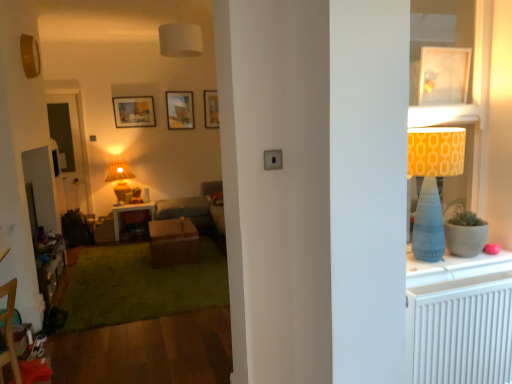
This screenshot has height=384, width=512. Find the location of `matte wooden desk at center`. matte wooden desk at center is located at coordinates (130, 210).

Where is `textured gray couch at center`? textured gray couch at center is located at coordinates (194, 208).

Describe the element at coordinates (74, 152) in the screenshot. I see `transparent glass door at left` at that location.

Locate an element on the screen. Image resolution: width=512 pixels, height=384 pixels. matte wooden desk at center is located at coordinates (130, 210).

Is matte yellow lampshade at center, the 1th lamp from the back, next to white glossy picture frame at upper right, which appears as the 4th picture frame when viewed from the back?

matte yellow lampshade at center, the 1th lamp from the back, and white glossy picture frame at upper right, which appears as the 4th picture frame when viewed from the back, are not in contact.

Is point (132, 173) closer or farther from the camera than point (455, 48)?

Point (132, 173) is positioned farther from the camera compared to point (455, 48).

Between matte yellow lampshade at center, the 1th lamp from the back, and white glossy picture frame at upper right, the 4th picture frame from the left, which one has larger size?

With larger size is matte yellow lampshade at center, the 1th lamp from the back.

Does matte yellow lampshade at center, which appears as the 1th lamp when viewed from the left, lie behind white glossy picture frame at upper right, which appears as the 4th picture frame when viewed from the back?

Yes, matte yellow lampshade at center, which appears as the 1th lamp when viewed from the left, is behind white glossy picture frame at upper right, which appears as the 4th picture frame when viewed from the back.

Find the location of a particular element. lamp that is the 3rd one when counting forward from the wooden picture frame at upper center, the 1th picture frame when ordered from back to front is located at coordinates (432, 183).

Is wooden picture frame at upper center, marked as the 4th picture frame in a front-to-back arrangement, completely or partially outside of matte blue cone-shaped lampshade at right, which is the third lamp from left to right?

wooden picture frame at upper center, marked as the 4th picture frame in a front-to-back arrangement, is positioned outside matte blue cone-shaped lampshade at right, which is the third lamp from left to right.

Does wooden picture frame at upper center, marked as the 4th picture frame in a front-to-back arrangement, have a larger size compared to matte blue cone-shaped lampshade at right, positioned as the first lamp in front-to-back order?

No.

How much distance is there between wooden picture frame at upper center, marked as the 4th picture frame in a front-to-back arrangement, and matte blue cone-shaped lampshade at right, which is the first lamp in right-to-left order?

wooden picture frame at upper center, marked as the 4th picture frame in a front-to-back arrangement, and matte blue cone-shaped lampshade at right, which is the first lamp in right-to-left order, are 5.18 meters apart from each other.

Does point (46, 251) come behind point (453, 147)?

Yes, point (46, 251) is farther from viewer.

Does wooden dresser at lower left come behind matte blue cone-shaped lampshade at right, the first lamp in the bottom-to-top sequence?

Yes, it is.

From a real-world perspective, which is physically above, wooden dresser at lower left or matte blue cone-shaped lampshade at right, the first lamp in the bottom-to-top sequence?

matte blue cone-shaped lampshade at right, the first lamp in the bottom-to-top sequence, from a real-world perspective.

Which is correct: wooden dresser at lower left is inside matte blue cone-shaped lampshade at right, which is the first lamp in right-to-left order, or outside of it?

wooden dresser at lower left lies outside matte blue cone-shaped lampshade at right, which is the first lamp in right-to-left order.

From a real-world perspective, starting from the wooden picture frame at upper center, the second picture frame from the back, which lamp is the 2nd one below it? Please provide its 2D coordinates.

[(120, 178)]

What's the angular difference between matte yellow lampshade at center, which ranks as the second lamp in top-to-bottom order, and wooden picture frame at upper center, arranged as the third picture frame when viewed from the right,'s facing directions?

The facing directions of matte yellow lampshade at center, which ranks as the second lamp in top-to-bottom order, and wooden picture frame at upper center, arranged as the third picture frame when viewed from the right, are 1.66 degrees apart.

Does matte yellow lampshade at center, the 2th lamp positioned from the bottom, lie in front of wooden picture frame at upper center, arranged as the third picture frame when viewed from the right?

Yes, matte yellow lampshade at center, the 2th lamp positioned from the bottom, is closer to the viewer.

Is point (116, 189) less distant than point (189, 126)?

Yes, point (116, 189) is closer to viewer.

Which is behind, point (429, 81) or point (116, 217)?

Positioned behind is point (116, 217).

From the image's perspective, is white glossy picture frame at upper right, arranged as the first picture frame when viewed from the right, on top of matte wooden desk at center?

Yes, from the image's perspective, white glossy picture frame at upper right, arranged as the first picture frame when viewed from the right, is over matte wooden desk at center.

Based on the photo, from a real-world perspective, is white glossy picture frame at upper right, arranged as the first picture frame when viewed from the right, positioned under matte wooden desk at center based on gravity?

Incorrect, from a real-world perspective, white glossy picture frame at upper right, arranged as the first picture frame when viewed from the right, is higher than matte wooden desk at center.

From the image's perspective, is matte blue cone-shaped lampshade at right, which is the third lamp from left to right, positioned above or below textured gray couch at center?

From the image's perspective, matte blue cone-shaped lampshade at right, which is the third lamp from left to right, appears above textured gray couch at center.

In the scene shown: Can you tell me how much matte blue cone-shaped lampshade at right, which is the first lamp in right-to-left order, and textured gray couch at center differ in facing direction?

matte blue cone-shaped lampshade at right, which is the first lamp in right-to-left order, and textured gray couch at center are facing 90 degrees away from each other.

Who is shorter, matte blue cone-shaped lampshade at right, the 3th lamp in the top-to-bottom sequence, or textured gray couch at center?

With less height is matte blue cone-shaped lampshade at right, the 3th lamp in the top-to-bottom sequence.

From a real-world perspective, is matte blue cone-shaped lampshade at right, positioned as the first lamp in front-to-back order, located beneath textured gray couch at center?

No, from a real-world perspective, matte blue cone-shaped lampshade at right, positioned as the first lamp in front-to-back order, is not below textured gray couch at center.

Considering the relative sizes of wooden picture frame at upper center, the 3th picture frame viewed from the front, and brown matte table at center in the image provided, is wooden picture frame at upper center, the 3th picture frame viewed from the front, wider than brown matte table at center?

No.

In the scene shown: Considering the sizes of objects wooden picture frame at upper center, the 3th picture frame viewed from the front, and brown matte table at center in the image provided, who is taller, wooden picture frame at upper center, the 3th picture frame viewed from the front, or brown matte table at center?

Standing taller between the two is wooden picture frame at upper center, the 3th picture frame viewed from the front.

From a real-world perspective, which is physically below, wooden picture frame at upper center, the second picture frame from the back, or brown matte table at center?

brown matte table at center is physically lower.

Is wooden picture frame at upper center, the 3th picture frame viewed from the front, next to brown matte table at center and touching it?

There is a gap between wooden picture frame at upper center, the 3th picture frame viewed from the front, and brown matte table at center.

Where is `the 2nd lamp below the white glossy picture frame at upper right, arranged as the first picture frame when viewed from the right (from a real-world perspective)`? The width and height of the screenshot is (512, 384). the 2nd lamp below the white glossy picture frame at upper right, arranged as the first picture frame when viewed from the right (from a real-world perspective) is located at coordinates (120, 178).

From the image's perspective, which picture frame is the 4th one above the matte blue cone-shaped lampshade at right, which is the third lamp from left to right? Please provide its 2D coordinates.

[(211, 109)]

Estimate the real-world distances between objects in this image. Which object is further from wooden picture frame at upper center, which is counted as the third picture frame, starting from the left, white glossy picture frame at upper right, the 1th picture frame in the front-to-back sequence, or white textured radiator at right?

The object further to wooden picture frame at upper center, which is counted as the third picture frame, starting from the left, is white textured radiator at right.

From the image, which object appears to be farther from brown matte table at center, white fabric lampshade at upper center, which appears as the 2th lamp when viewed from the back, or white textured radiator at right?

white textured radiator at right lies further to brown matte table at center than the other object.

Looking at the image, which one is located further to matte blue cone-shaped lampshade at right, the 3th lamp in the top-to-bottom sequence, wooden picture frame at upper center, the second picture frame from the back, or brown matte table at center?

Among the two, wooden picture frame at upper center, the second picture frame from the back, is located further to matte blue cone-shaped lampshade at right, the 3th lamp in the top-to-bottom sequence.

Looking at the image, which one is located closer to matte wooden picture frame at upper center, marked as the first picture frame in a left-to-right arrangement, matte yellow lampshade at center, the 2th lamp positioned from the bottom, or matte blue cone-shaped lampshade at right, the 3th lamp in the top-to-bottom sequence?

→ matte yellow lampshade at center, the 2th lamp positioned from the bottom.

From the image, which object appears to be farther from transparent glass door at left, wooden dresser at lower left or matte yellow lampshade at center, the 2th lamp positioned from the bottom?

wooden dresser at lower left.

Based on their spatial positions, is textured gray couch at center or white textured radiator at right further from matte blue cone-shaped lampshade at right, the 3th lamp in the top-to-bottom sequence?

Based on the image, textured gray couch at center appears to be further to matte blue cone-shaped lampshade at right, the 3th lamp in the top-to-bottom sequence.

Which object lies further to the anchor point white glossy picture frame at upper right, the 1th picture frame in the front-to-back sequence, brown matte table at center or white fabric lampshade at upper center, which is counted as the second lamp, starting from the left?

Among the two, brown matte table at center is located further to white glossy picture frame at upper right, the 1th picture frame in the front-to-back sequence.

Looking at the image, which one is located further to white glossy picture frame at upper right, the 1th picture frame in the front-to-back sequence, wooden picture frame at upper center, the 2th picture frame from the left, or textured gray couch at center?

The object further to white glossy picture frame at upper right, the 1th picture frame in the front-to-back sequence, is wooden picture frame at upper center, the 2th picture frame from the left.

Find the location of a particular element. picture frame between matte blue cone-shaped lampshade at right, the first lamp in the bottom-to-top sequence, and white fabric lampshade at upper center, the first lamp viewed from the top, along the z-axis is located at coordinates (444, 75).

You are a GUI agent. You are given a task and a screenshot of the screen. Output one action in this format:
    pyautogui.click(x=<x>, y=<y>)
    Task: Click on the table between wooden dresser at lower left and wooden picture frame at upper center, the 3th picture frame viewed from the front, along the z-axis
    This screenshot has height=384, width=512.
    Given the screenshot: What is the action you would take?
    pyautogui.click(x=173, y=242)

In order to click on studio couch between wooden picture frame at upper center, the 2th picture frame from the left, and matte wooden desk at center in the up-down direction in this screenshot , I will do `click(194, 208)`.

Where is `lamp positioned between brown matte table at center and wooden picture frame at upper center, marked as the 4th picture frame in a front-to-back arrangement, from near to far`? This screenshot has height=384, width=512. lamp positioned between brown matte table at center and wooden picture frame at upper center, marked as the 4th picture frame in a front-to-back arrangement, from near to far is located at coordinates (120, 178).